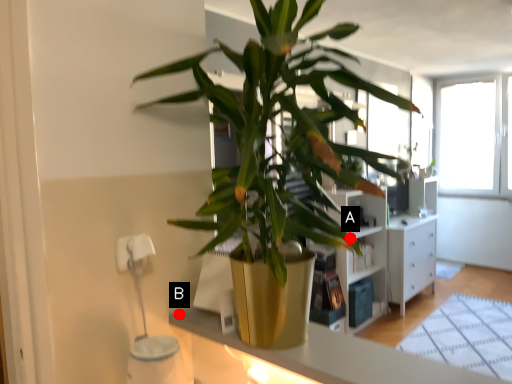
Question: Two points are circled on the image, labeled by A and B beside each circle. Which point is closer to the camera?

Choices:
 (A) A is closer
 (B) B is closer

Answer: (A)